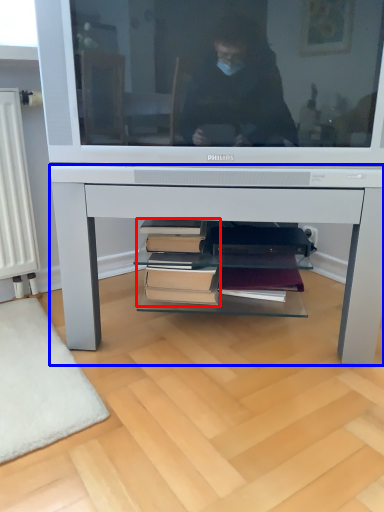
Question: Which of the following is the farthest to the observer, book (highlighted by a red box) or desk (highlighted by a blue box)?

Choices:
 (A) book
 (B) desk

Answer: (A)